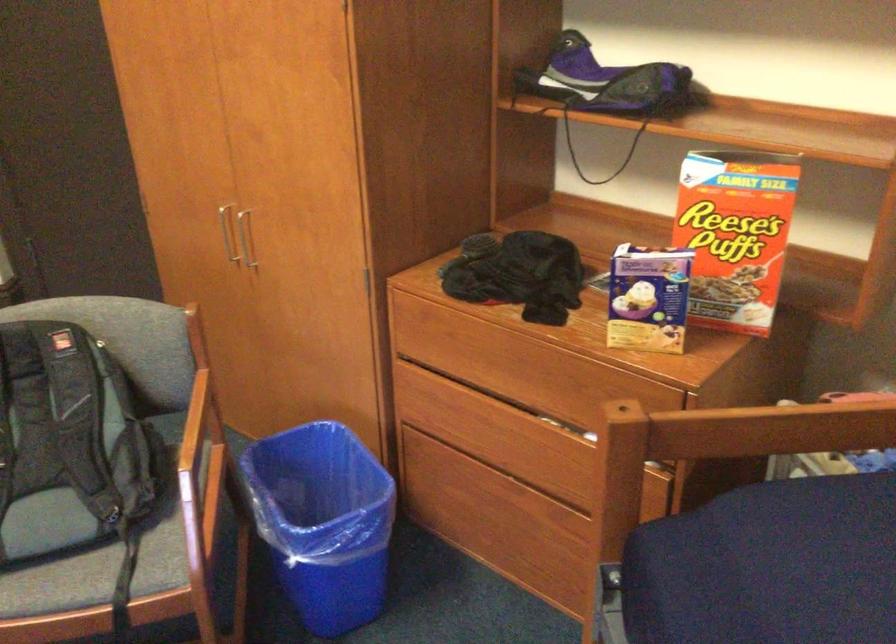
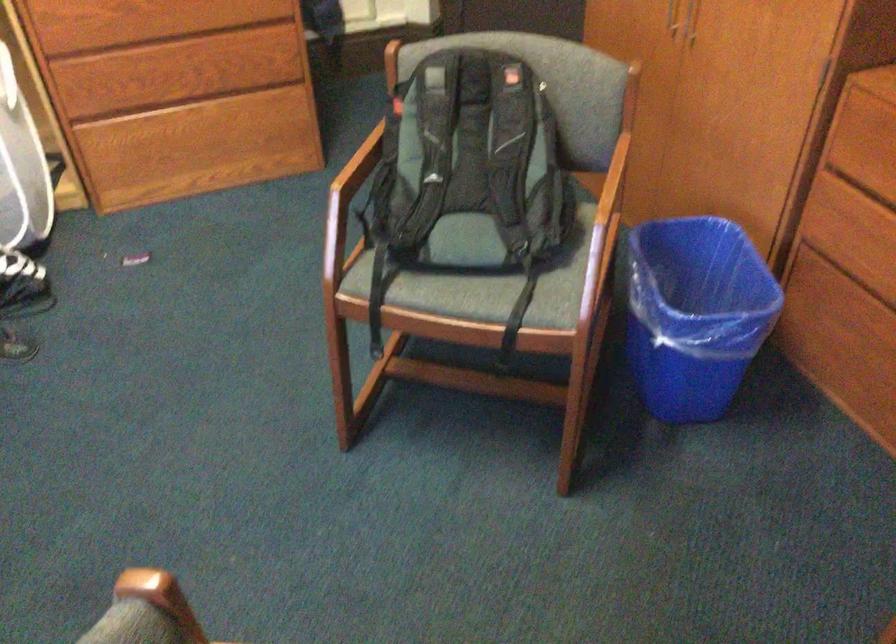
The point at (x=245, y=251) is marked in the first image. Where is the corresponding point in the second image?

(691, 21)